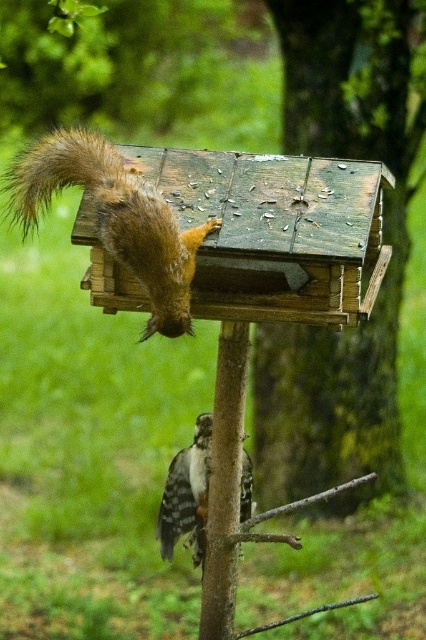
Who is positioned more to the right, weathered wood birdhouse at center or brown furry squirrel at upper left?

From the viewer's perspective, weathered wood birdhouse at center appears more on the right side.

Is weathered wood birdhouse at center to the right of brown furry squirrel at upper left from the viewer's perspective?

Indeed, weathered wood birdhouse at center is positioned on the right side of brown furry squirrel at upper left.

Who is more forward, (374, 408) or (161, 280)?

Point (161, 280)

At what (x,y) coordinates should I click in order to perform the action: click on weathered wood birdhouse at center. Please return your answer as a coordinate pair (x, y). The image size is (426, 640). Looking at the image, I should click on (382, 241).

Measure the distance between point (385, 376) and camera.

Point (385, 376) and camera are 4.88 meters apart.

What do you see at coordinates (382, 241) in the screenshot?
I see `weathered wood birdhouse at center` at bounding box center [382, 241].

This screenshot has height=640, width=426. I want to click on weathered wood birdhouse at center, so click(x=382, y=241).

Who is positioned more to the right, brown furry squirrel at upper left or speckled brown woodpecker at lower center?

Positioned to the right is speckled brown woodpecker at lower center.

Between point (13, 182) and point (187, 477), which one is positioned in front?

Point (13, 182)

Find the location of `brown furry squirrel at upper left`. brown furry squirrel at upper left is located at coordinates (114, 218).